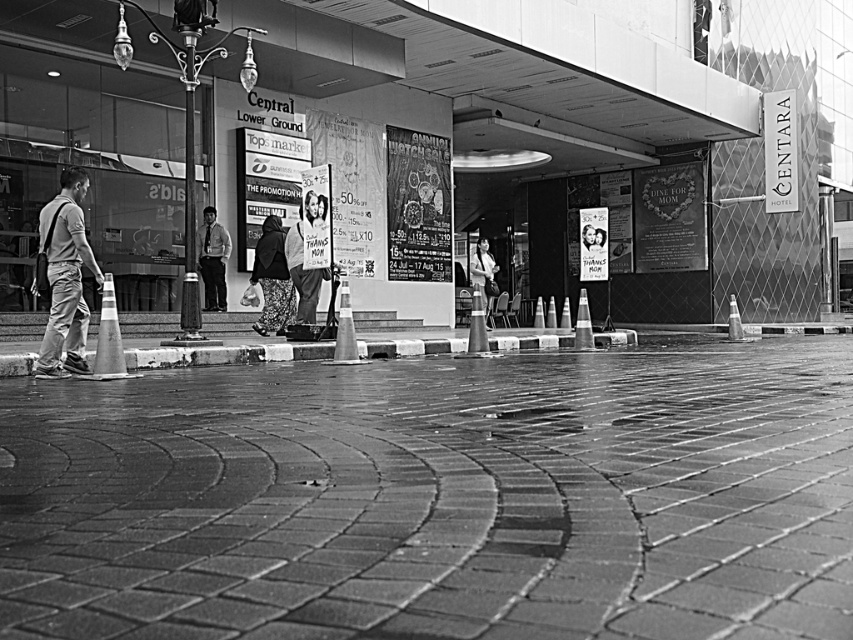
You are standing at the entrance of the Central Lower Ground building and notice two points marked on the ground. The first point is at coordinates point [78,314] and the second is at point [497,292]. If you were to walk from the first point to the second point, would you be moving towards the building or away from it?

Since point [78,314] is in front of point [497,292], moving from the first point to the second would mean walking away from the building.

You are a photographer standing at the entrance of the building. You notice two people in the scene, one wearing light gray jeans at left and another wearing light brown shirt at center. Which person is standing closer to the entrance?

The light gray jeans at left is taller than light brown shirt at center, so the light brown shirt at center is closer to the entrance because objects that appear taller in a photograph taken from a low angle are typically closer to the camera.

You are standing at the entrance of the building and want to place a new sign on the smooth concrete pavement at center. According to the coordinates provided, where exactly should the sign be placed?

The smooth concrete pavement at center should have the new sign placed at point (437, 499) as specified in the coordinates.